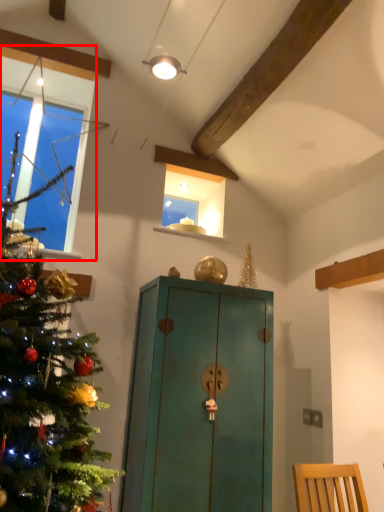
Question: From the image's perspective, where is window (annotated by the red box) located relative to cabinetry?

Choices:
 (A) above
 (B) below

Answer: (A)